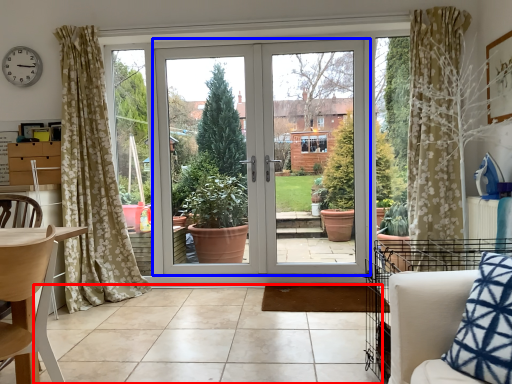
Question: Which point is further to the camera, tile (highlighted by a red box) or door (highlighted by a blue box)?

Choices:
 (A) tile
 (B) door

Answer: (B)